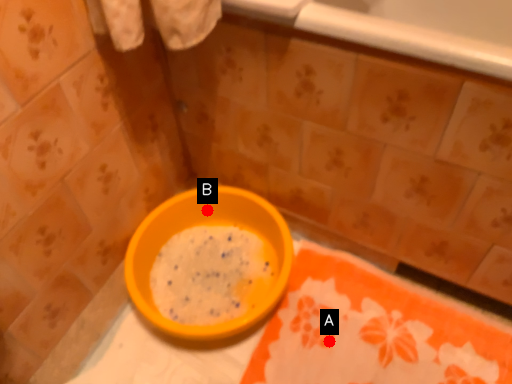
Question: Two points are circled on the image, labeled by A and B beside each circle. Which point is farther from the camera taking this photo?

Choices:
 (A) A is further
 (B) B is further

Answer: (B)